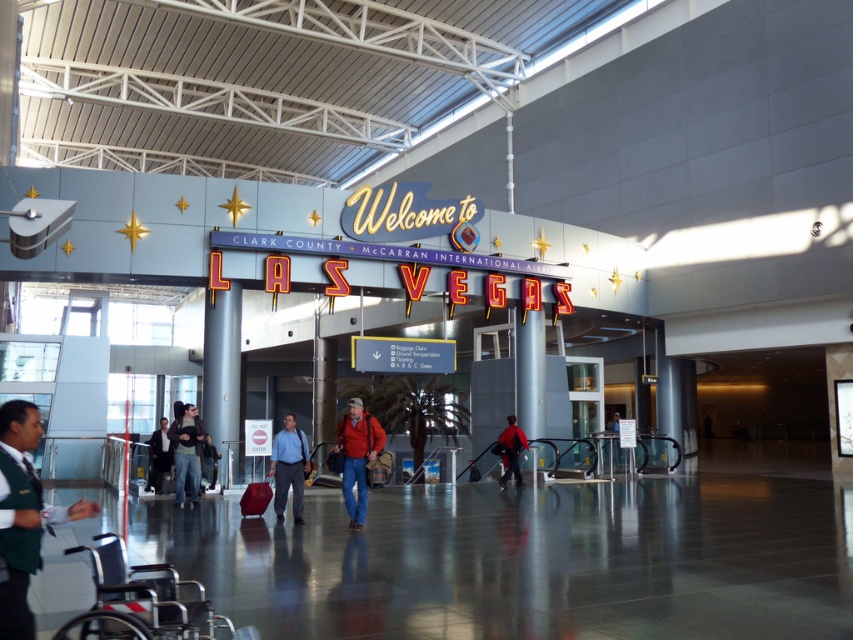
Question: Based on their relative distances, which object is farther from the dark blue jacket at center?

Choices:
 (A) blue shirt at center
 (B) red matte jacket at center
 (C) green uniform at left
 (D) denim jacket at center

Answer: (C)

Question: Can you confirm if jeans at center is positioned below denim jacket at center?

Choices:
 (A) no
 (B) yes

Answer: (B)

Question: Considering the real-world distances, which object is farthest from the denim jacket at center?

Choices:
 (A) smooth gray pillar at center
 (B) green uniform at left

Answer: (B)

Question: Which of these objects is positioned farthest from the red fabric jacket at center?

Choices:
 (A) gray concrete pillar at center
 (B) jeans at center
 (C) smooth gray pillar at center

Answer: (A)

Question: Can you confirm if green uniform at left is positioned to the left of gray concrete pillar at center?

Choices:
 (A) no
 (B) yes

Answer: (A)

Question: Where is smooth gray pillar at center located in relation to jeans at center in the image?

Choices:
 (A) below
 (B) above

Answer: (B)